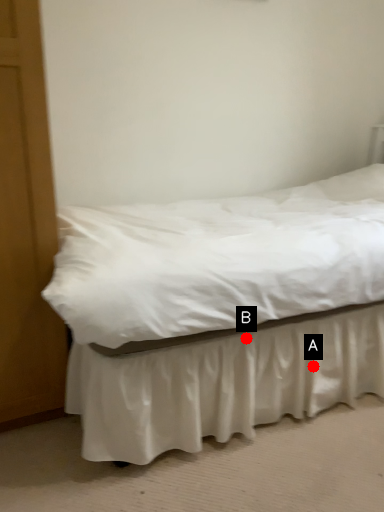
Question: Two points are circled on the image, labeled by A and B beside each circle. Which point is closer to the camera taking this photo?

Choices:
 (A) A is closer
 (B) B is closer

Answer: (B)